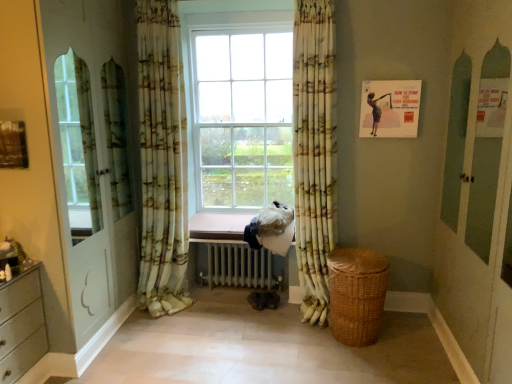
Question: Can you confirm if pink wood at center is shorter than printed fabric curtain at left, the second curtain when ordered from right to left?

Choices:
 (A) yes
 (B) no

Answer: (A)

Question: Is pink wood at center positioned with its back to printed fabric curtain at left, the 1th curtain in the left-to-right sequence?

Choices:
 (A) yes
 (B) no

Answer: (B)

Question: Is pink wood at center smaller than printed fabric curtain at left, the second curtain when ordered from right to left?

Choices:
 (A) no
 (B) yes

Answer: (B)

Question: Is printed fabric curtain at left, the 1th curtain in the left-to-right sequence, a part of pink wood at center?

Choices:
 (A) no
 (B) yes

Answer: (A)

Question: Would you consider pink wood at center to be distant from printed fabric curtain at left, the 1th curtain in the left-to-right sequence?

Choices:
 (A) no
 (B) yes

Answer: (A)

Question: From a real-world perspective, does pink wood at center sit lower than printed fabric curtain at left, the 1th curtain in the left-to-right sequence?

Choices:
 (A) yes
 (B) no

Answer: (A)

Question: Can you confirm if printed fabric curtain at left, the 1th curtain in the left-to-right sequence, is wider than white metallic radiator at center?

Choices:
 (A) yes
 (B) no

Answer: (B)

Question: Does printed fabric curtain at left, the second curtain when ordered from right to left, appear on the right side of white metallic radiator at center?

Choices:
 (A) yes
 (B) no

Answer: (B)

Question: Is printed fabric curtain at left, the second curtain when ordered from right to left, further to camera compared to white metallic radiator at center?

Choices:
 (A) no
 (B) yes

Answer: (A)

Question: Is printed fabric curtain at left, the second curtain when ordered from right to left, turned away from white metallic radiator at center?

Choices:
 (A) no
 (B) yes

Answer: (A)

Question: From the image's perspective, would you say printed fabric curtain at left, the 1th curtain in the left-to-right sequence, is shown under white metallic radiator at center?

Choices:
 (A) yes
 (B) no

Answer: (B)

Question: Considering the relative sizes of printed fabric curtain at left, the 1th curtain in the left-to-right sequence, and white metallic radiator at center in the image provided, is printed fabric curtain at left, the 1th curtain in the left-to-right sequence, taller than white metallic radiator at center?

Choices:
 (A) yes
 (B) no

Answer: (A)

Question: Could you tell me if yellow-green floral fabric curtain at center, positioned as the 1th curtain in right-to-left order, is facing pink wood at center?

Choices:
 (A) no
 (B) yes

Answer: (A)